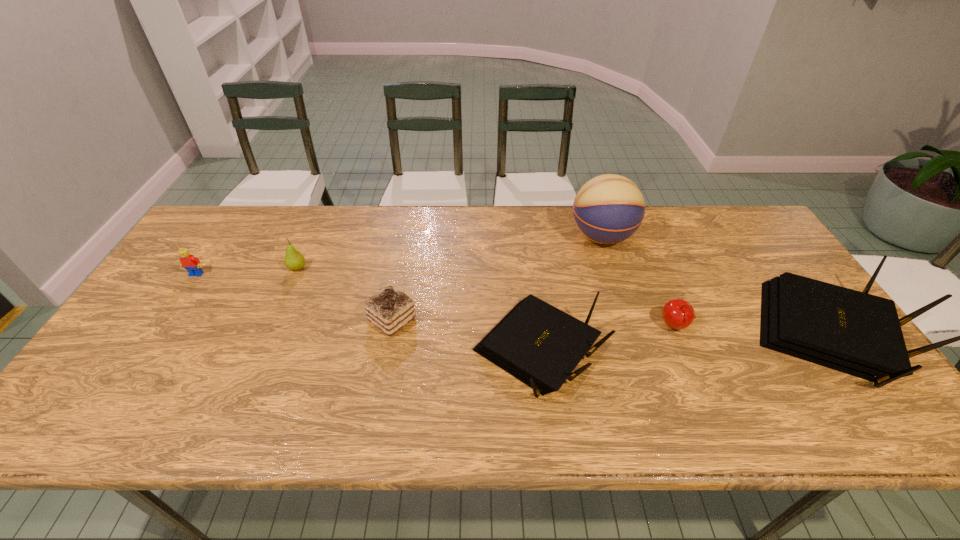
In the current image, all routers are evenly spaced. To maintain this equal spacing, where should an additional router be placed on the left? Please point out a free spot. Please provide its 2D coordinates. Your answer should be formatted as a tuple, i.e. [(x, y)], where the tuple contains the x and y coordinates of a point satisfying the conditions above.

[(226, 366)]